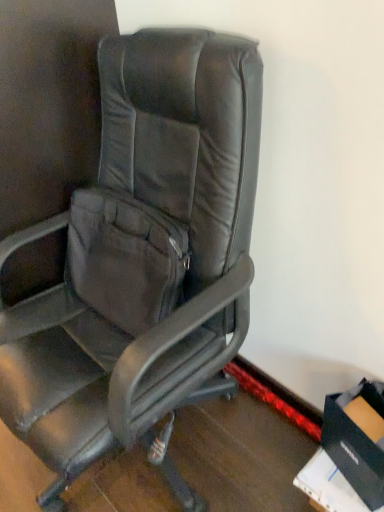
At what (x,y) coordinates should I click in order to perform the action: click on black leather chair at center. Please return your answer as a coordinate pair (x, y). The width and height of the screenshot is (384, 512). Looking at the image, I should click on (142, 253).

What do you see at coordinates (142, 253) in the screenshot? Image resolution: width=384 pixels, height=512 pixels. I see `black leather chair at center` at bounding box center [142, 253].

In order to face black leather chair at center, should I rotate leftwards or rightwards?

Turn left by 10.726 degrees to look at black leather chair at center.

Where is `black cardboard box at lower right`? black cardboard box at lower right is located at coordinates (356, 442).

Describe the element at coordinates (356, 442) in the screenshot. I see `black cardboard box at lower right` at that location.

This screenshot has height=512, width=384. Find the location of `black leather chair at center`. black leather chair at center is located at coordinates (142, 253).

Does black cardboard box at lower right appear on the left side of black leather chair at center?

No.

In the scene shown: Is black cardboard box at lower right further to camera compared to black leather chair at center?

Yes.

Does point (357, 493) come farther from viewer compared to point (181, 111)?

Yes, it is.

From the image's perspective, is black cardboard box at lower right located beneath black leather chair at center?

Yes, from the image's perspective, black cardboard box at lower right is below black leather chair at center.

From a real-world perspective, which object stands above the other?

black leather chair at center.

Between black cardboard box at lower right and black leather chair at center, which one has larger width?

black leather chair at center.

Considering the sizes of objects black cardboard box at lower right and black leather chair at center in the image provided, who is shorter, black cardboard box at lower right or black leather chair at center?

black cardboard box at lower right is shorter.

Considering the relative sizes of black cardboard box at lower right and black leather chair at center in the image provided, is black cardboard box at lower right bigger than black leather chair at center?

No.

Is black cardboard box at lower right not inside black leather chair at center?

black cardboard box at lower right is positioned outside black leather chair at center.

Are black cardboard box at lower right and black leather chair at center making contact?

They are not placed beside each other.

Is black cardboard box at lower right turned away from black leather chair at center?

That's not correct — black cardboard box at lower right is not looking away from black leather chair at center.

How different are the orientations of black cardboard box at lower right and black leather chair at center in degrees?

19.5 degrees separate the facing orientations of black cardboard box at lower right and black leather chair at center.

How far apart are black cardboard box at lower right and black leather chair at center?

They are 23.38 inches apart.

You are a GUI agent. You are given a task and a screenshot of the screen. Output one action in this format:
    pyautogui.click(x=<x>, y=<y>)
    Task: Click on the chair above the black cardboard box at lower right (from a real-world perspective)
    This screenshot has width=384, height=512.
    Given the screenshot: What is the action you would take?
    142,253

Does black leather chair at center appear on the right side of black cardboard box at lower right?

Incorrect, black leather chair at center is not on the right side of black cardboard box at lower right.

Is the position of black leather chair at center less distant than that of black cardboard box at lower right?

Yes, it is.

Is point (65, 372) positioned behind point (382, 459)?

Yes, it is behind point (382, 459).

From the image's perspective, is black leather chair at center on black cardboard box at lower right?

Yes, from the image's perspective, black leather chair at center is over black cardboard box at lower right.

From the picture: From a real-world perspective, is black leather chair at center physically above black cardboard box at lower right?

Yes, from a real-world perspective, black leather chair at center is on top of black cardboard box at lower right.

Looking at this image, considering the sizes of objects black leather chair at center and black cardboard box at lower right in the image provided, who is wider, black leather chair at center or black cardboard box at lower right?

black leather chair at center.

Considering the sizes of black leather chair at center and black cardboard box at lower right in the image, is black leather chair at center taller or shorter than black cardboard box at lower right?

In the image, black leather chair at center appears to be taller than black cardboard box at lower right.

Does black leather chair at center have a larger size compared to black cardboard box at lower right?

Indeed, black leather chair at center has a larger size compared to black cardboard box at lower right.

In the scene shown: Is black leather chair at center not inside black cardboard box at lower right?

Yes.

Would you consider black leather chair at center to be distant from black cardboard box at lower right?

No, there isn't a large distance between black leather chair at center and black cardboard box at lower right.

Could you tell me if black leather chair at center is turned towards black cardboard box at lower right?

No, black leather chair at center does not turn towards black cardboard box at lower right.

You are a GUI agent. You are given a task and a screenshot of the screen. Output one action in this format:
    pyautogui.click(x=<x>, y=<y>)
    Task: Click on the cardboard box behind the black leather chair at center
    
    Given the screenshot: What is the action you would take?
    pyautogui.click(x=356, y=442)

The image size is (384, 512). What are the coordinates of `cardboard box behind the black leather chair at center` in the screenshot? It's located at (356, 442).

You are a GUI agent. You are given a task and a screenshot of the screen. Output one action in this format:
    pyautogui.click(x=<x>, y=<y>)
    Task: Click on the chair above the black cardboard box at lower right (from a real-world perspective)
    This screenshot has height=512, width=384.
    Given the screenshot: What is the action you would take?
    pyautogui.click(x=142, y=253)